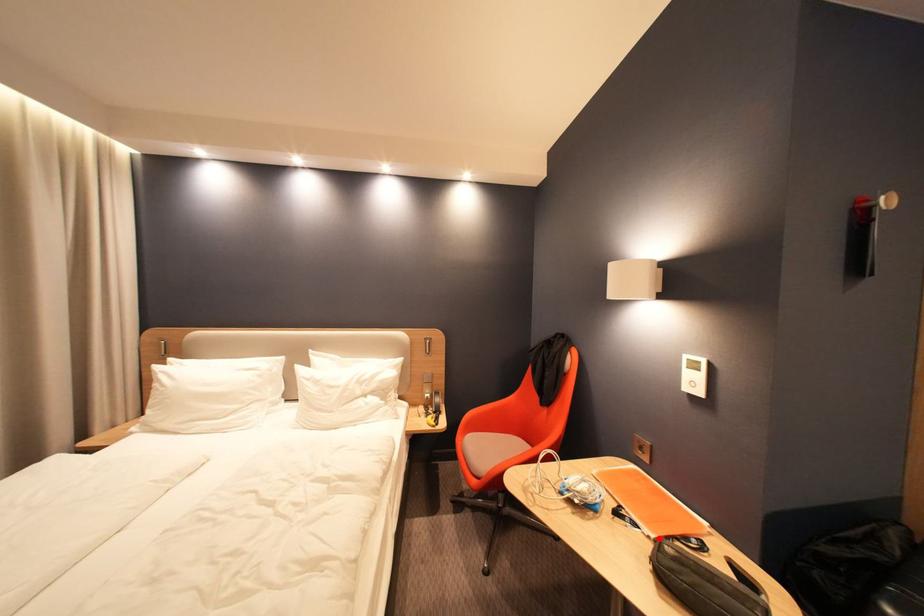
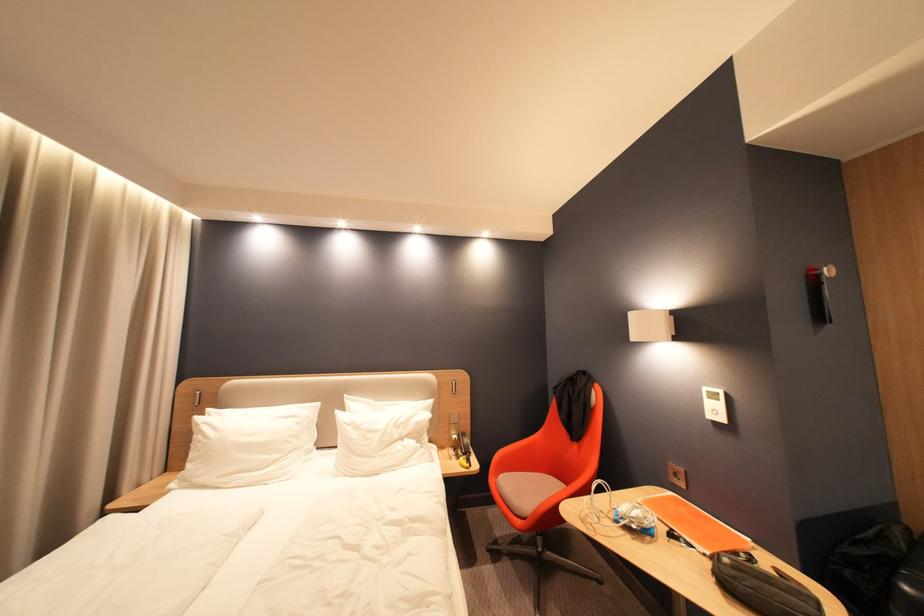
Where in the second image is the point corresponding to the highlighted location from the first image?

(714, 556)